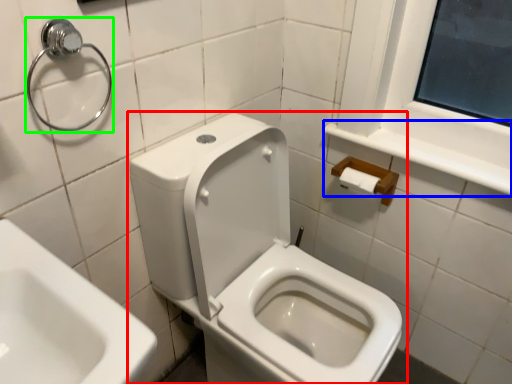
Question: Which object is positioned farthest from toilet (highlighted by a red box)? Select from balustrade (highlighted by a blue box) and shower (highlighted by a green box).

Choices:
 (A) balustrade
 (B) shower

Answer: (B)